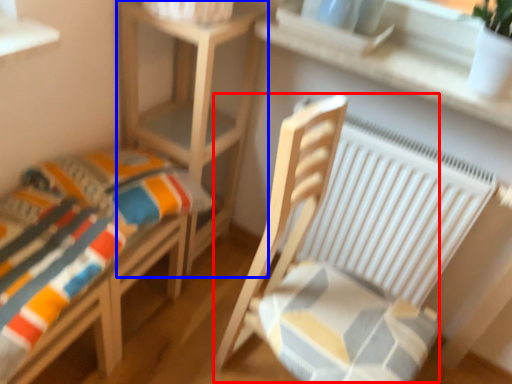
Question: Which point is closer to the camera, rocking chair (highlighted by a red box) or table (highlighted by a blue box)?

Choices:
 (A) rocking chair
 (B) table

Answer: (A)